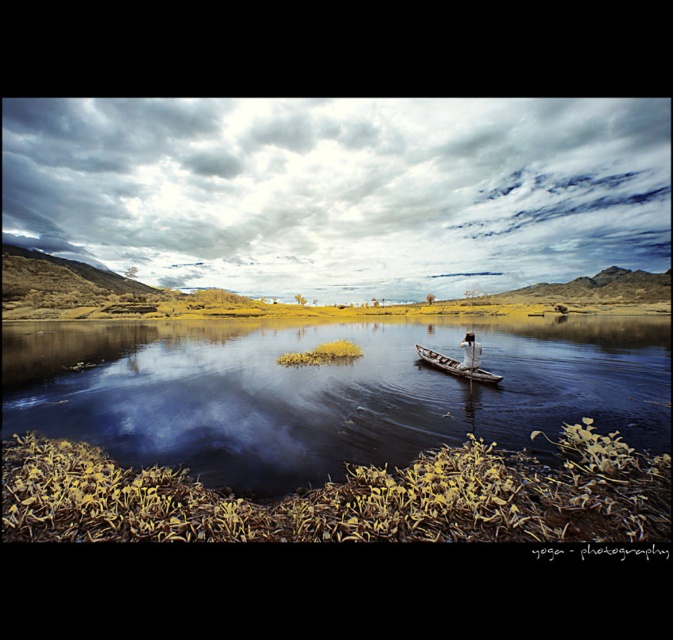
You are standing at the point with coordinates point (491, 378) and want to walk towards the point with coordinates point (256, 451). Which direction should you move relative to your current position?

You should move forward because point (256, 451) is in front of point (491, 378).

Based on the photo, you are standing on the grassy terrain in the foreground and want to reach the boat. Which direction should you walk to get to the white fabric boat at center from the smooth dark water at center?

The smooth dark water at center is positioned on the left side of the white fabric boat at center. Therefore, to reach the white fabric boat at center from the smooth dark water at center, you should walk to the right.